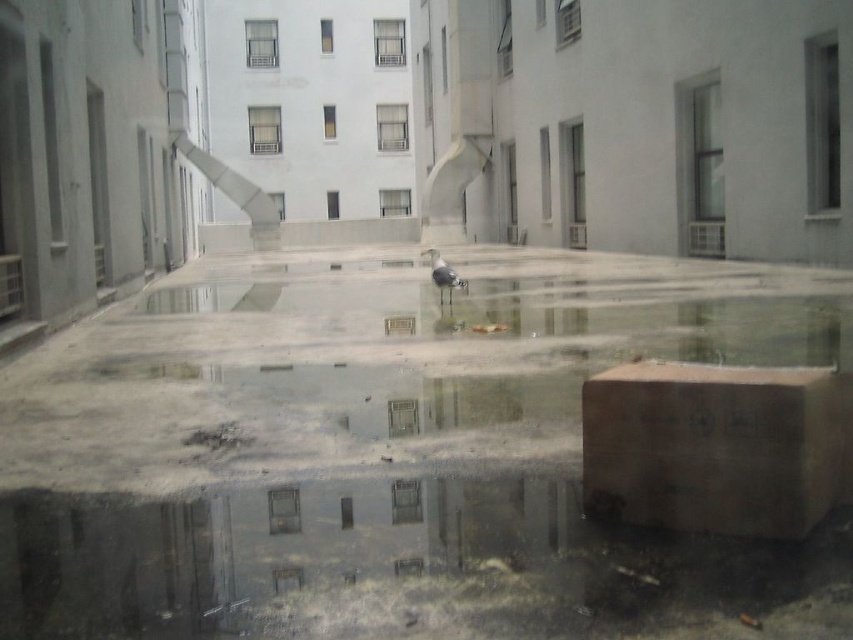
Does clear concrete water at center have a greater width compared to brown cardboard box at lower right?

Yes, clear concrete water at center is wider than brown cardboard box at lower right.

Measure the distance from clear concrete water at center to brown cardboard box at lower right.

They are 1.88 meters apart.

Is point (561, 413) less distant than point (791, 497)?

No, (561, 413) is behind (791, 497).

I want to click on clear concrete water at center, so click(389, 454).